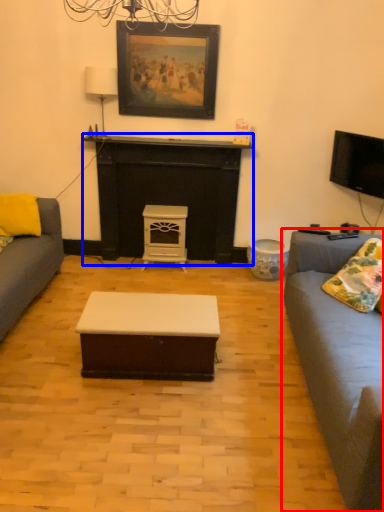
Question: Which point is closer to the camera, studio couch (highlighted by a red box) or fireplace (highlighted by a blue box)?

Choices:
 (A) studio couch
 (B) fireplace

Answer: (A)